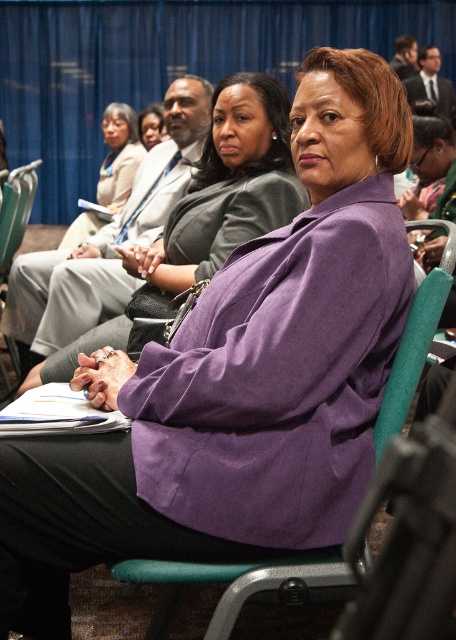
Is matte black suit at upper right in front of matte black suit at upper center?

Yes, it is.

Does matte black suit at upper right appear over matte black suit at upper center?

Actually, matte black suit at upper right is below matte black suit at upper center.

Measure the distance between point (x=421, y=81) and camera.

The distance of point (x=421, y=81) from camera is 6.15 meters.

The height and width of the screenshot is (640, 456). I want to click on matte black suit at upper right, so click(430, 81).

Is purple matte jacket at center positioned at the back of matte black suit at upper right?

No, it is not.

Which is behind, point (144, 182) or point (413, 83)?

Point (413, 83)

Is point (120, 275) positioned in front of point (423, 61)?

Yes, it is in front of point (423, 61).

Where is `purple matte jacket at center`? purple matte jacket at center is located at coordinates (76, 278).

Between teal fabric chair at center and matte black blazer at center, which one has more height?

Standing taller between the two is matte black blazer at center.

Which is in front, point (412, 371) or point (63, 241)?

Positioned in front is point (412, 371).

Where is `teal fabric chair at center`? teal fabric chair at center is located at coordinates (228, 584).